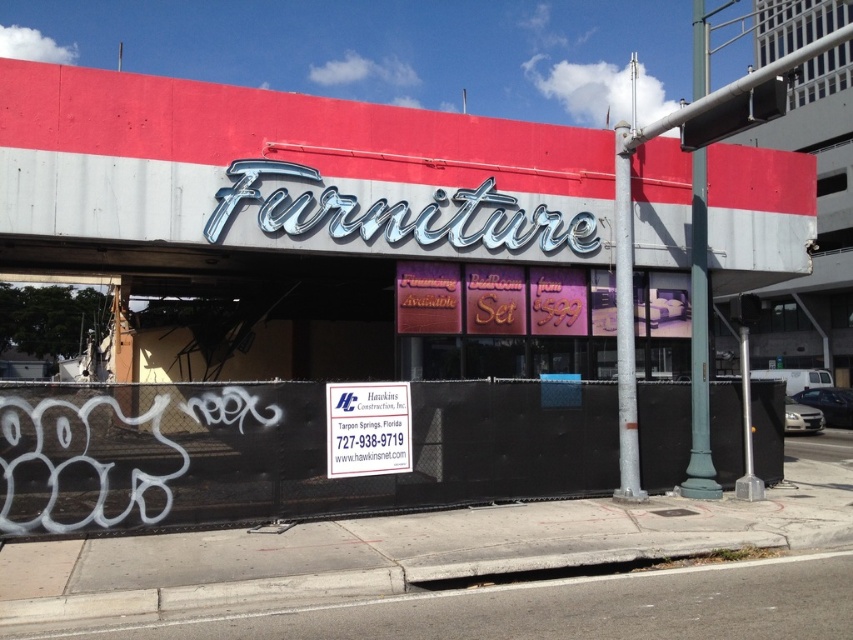
Question: Which point is farther to the camera?

Choices:
 (A) metallic signboard at center
 (B) white plastic sign at center

Answer: (B)

Question: Can you confirm if metallic signboard at center is wider than white plastic sign at center?

Choices:
 (A) yes
 (B) no

Answer: (A)

Question: Among these objects, which one is nearest to the camera?

Choices:
 (A) white plastic sign at center
 (B) metallic signboard at center

Answer: (B)

Question: Is metallic signboard at center closer to the viewer compared to white plastic sign at center?

Choices:
 (A) no
 (B) yes

Answer: (B)

Question: Which point is farther from the camera taking this photo?

Choices:
 (A) (376, 451)
 (B) (45, 108)

Answer: (B)

Question: Does metallic signboard at center lie behind white plastic sign at center?

Choices:
 (A) yes
 (B) no

Answer: (B)